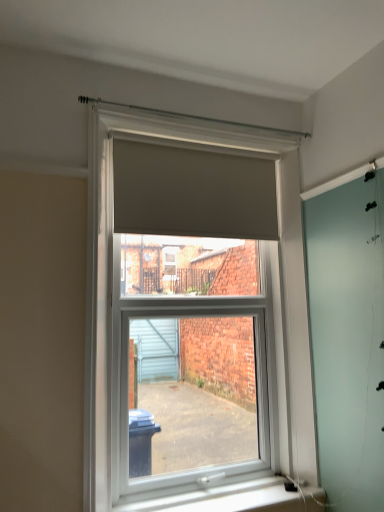
Identify the location of matte gray blind at upper center. This screenshot has width=384, height=512. (192, 192).

What are the coordinates of `matte gray blind at upper center` in the screenshot? It's located at (192, 192).

Is matte gray roller blind at center completely or partially outside of matte gray blind at upper center?

matte gray roller blind at center lies outside matte gray blind at upper center's area.

In the image, there is a matte gray blind at upper center. Where is `window below it (from a real-world perspective)`? window below it (from a real-world perspective) is located at coordinates (183, 298).

Does matte gray roller blind at center appear on the left side of matte gray blind at upper center?

No, matte gray roller blind at center is not to the left of matte gray blind at upper center.

In the scene shown: Is matte gray roller blind at center next to matte gray blind at upper center and touching it?

No.

Is white plastic window sill at lower center a part of matte gray roller blind at center?

No, matte gray roller blind at center does not contain white plastic window sill at lower center.

Looking at this image, from a real-world perspective, who is located higher, matte gray roller blind at center or white plastic window sill at lower center?

matte gray roller blind at center.

Is matte gray roller blind at center closer to camera compared to white plastic window sill at lower center?

Yes, matte gray roller blind at center is in front of white plastic window sill at lower center.

Does point (202, 300) lie in front of point (313, 506)?

No.

Considering the sizes of objects matte gray blind at upper center and white plastic window sill at lower center in the image provided, who is smaller, matte gray blind at upper center or white plastic window sill at lower center?

With smaller size is white plastic window sill at lower center.

From the image's perspective, would you say matte gray blind at upper center is positioned over white plastic window sill at lower center?

Yes.

Consider the image. Could you tell me if matte gray blind at upper center is facing white plastic window sill at lower center?

No, matte gray blind at upper center is not oriented towards white plastic window sill at lower center.

I want to click on window sill on the right of matte gray blind at upper center, so click(x=236, y=499).

Is white plastic window sill at lower center oriented away from matte gray blind at upper center?

No, white plastic window sill at lower center is not facing the opposite direction of matte gray blind at upper center.

Is white plastic window sill at lower center to the left of matte gray blind at upper center from the viewer's perspective?

Incorrect, white plastic window sill at lower center is not on the left side of matte gray blind at upper center.

Would you say matte gray blind at upper center is part of white plastic window sill at lower center's contents?

No, matte gray blind at upper center is not surrounded by white plastic window sill at lower center.

From the image's perspective, does white plastic window sill at lower center appear lower than matte gray blind at upper center?

Yes, from the image's perspective, white plastic window sill at lower center is below matte gray blind at upper center.

Which of these two, white plastic window sill at lower center or matte gray roller blind at center, stands shorter?

With less height is white plastic window sill at lower center.

Image resolution: width=384 pixels, height=512 pixels. I want to click on window in front of the white plastic window sill at lower center, so click(183, 298).

In the scene shown: Is white plastic window sill at lower center looking in the opposite direction of matte gray roller blind at center?

No, white plastic window sill at lower center is not facing away from matte gray roller blind at center.

Considering the sizes of objects white plastic window sill at lower center and matte gray roller blind at center in the image provided, who is wider, white plastic window sill at lower center or matte gray roller blind at center?

With larger width is matte gray roller blind at center.

Where is `blind on the left side of matte gray roller blind at center`? blind on the left side of matte gray roller blind at center is located at coordinates (192, 192).

Are matte gray blind at upper center and matte gray roller blind at center making contact?

They are not placed beside each other.

Can you confirm if matte gray blind at upper center is shorter than matte gray roller blind at center?

Indeed, matte gray blind at upper center has a lesser height compared to matte gray roller blind at center.

Does matte gray blind at upper center appear on the left side of matte gray roller blind at center?

Yes, matte gray blind at upper center is to the left of matte gray roller blind at center.

I want to click on window in front of the matte gray blind at upper center, so click(x=183, y=298).

Where is `window on the left of white plastic window sill at lower center`? window on the left of white plastic window sill at lower center is located at coordinates (183, 298).

From the image, which object appears to be farther from matte gray roller blind at center, matte gray blind at upper center or white plastic window sill at lower center?

Among the two, white plastic window sill at lower center is located further to matte gray roller blind at center.

When comparing their distances from matte gray blind at upper center, does white plastic window sill at lower center or matte gray roller blind at center seem further?

Based on the image, white plastic window sill at lower center appears to be further to matte gray blind at upper center.

From the image, which object appears to be farther from matte gray blind at upper center, matte gray roller blind at center or white plastic window sill at lower center?

Based on the image, white plastic window sill at lower center appears to be further to matte gray blind at upper center.

From the image, which object appears to be farther from white plastic window sill at lower center, matte gray blind at upper center or matte gray roller blind at center?

matte gray blind at upper center lies further to white plastic window sill at lower center than the other object.

Considering their positions, is white plastic window sill at lower center positioned further to matte gray roller blind at center than matte gray blind at upper center?

white plastic window sill at lower center.

Considering their positions, is matte gray roller blind at center positioned further to white plastic window sill at lower center than matte gray blind at upper center?

Based on the image, matte gray blind at upper center appears to be further to white plastic window sill at lower center.

What are the coordinates of `window between matte gray blind at upper center and white plastic window sill at lower center in the vertical direction` in the screenshot? It's located at (183, 298).